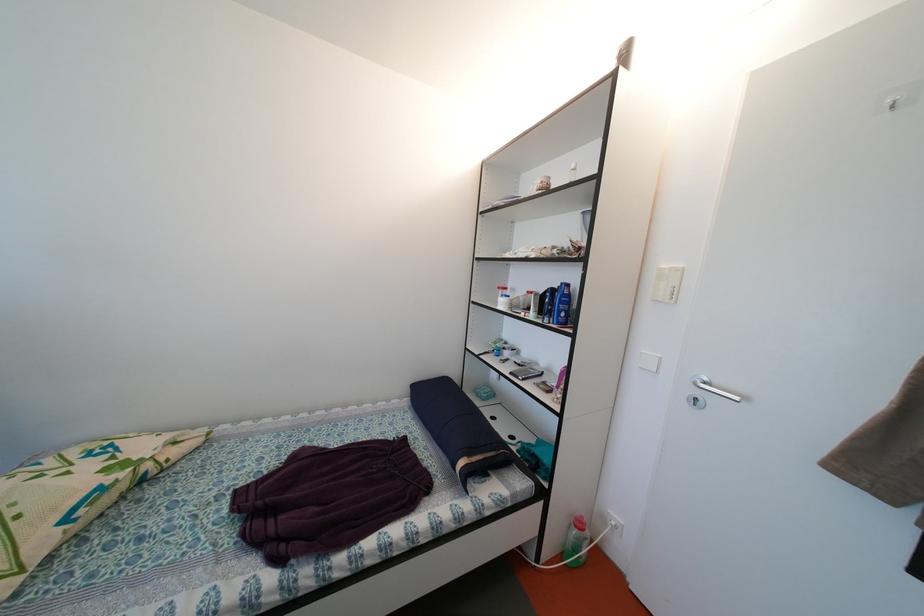
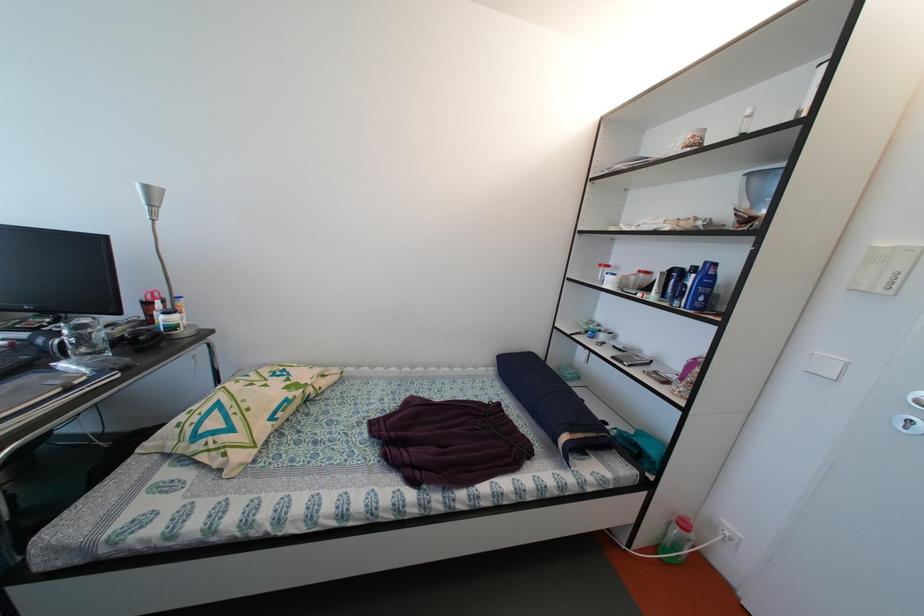
Question: What movement of the cameraman would produce the second image?

Choices:
 (A) Left
 (B) Right
 (C) Forward
 (D) Backward

Answer: (A)